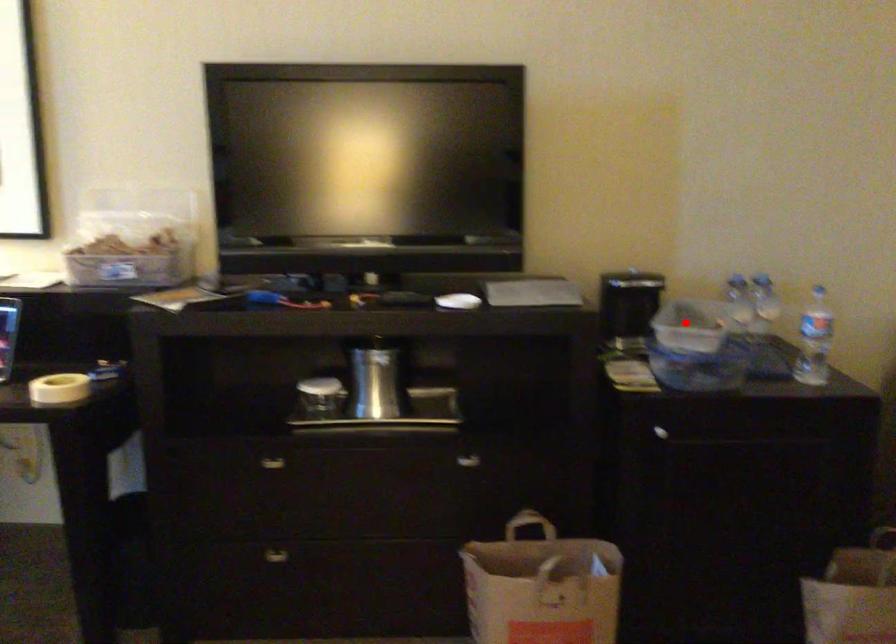
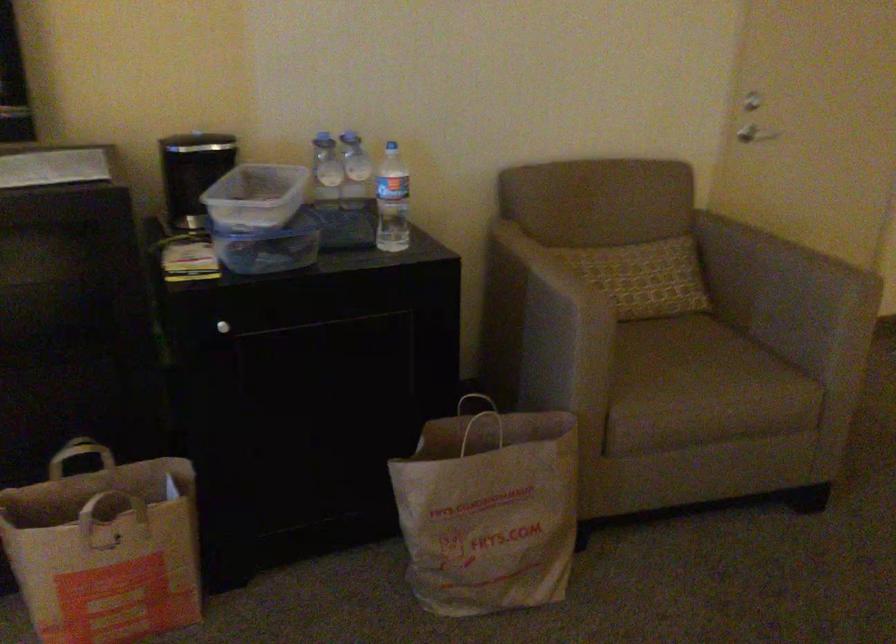
In the second image, find the point that corresponds to the highlighted location in the first image.

(255, 196)